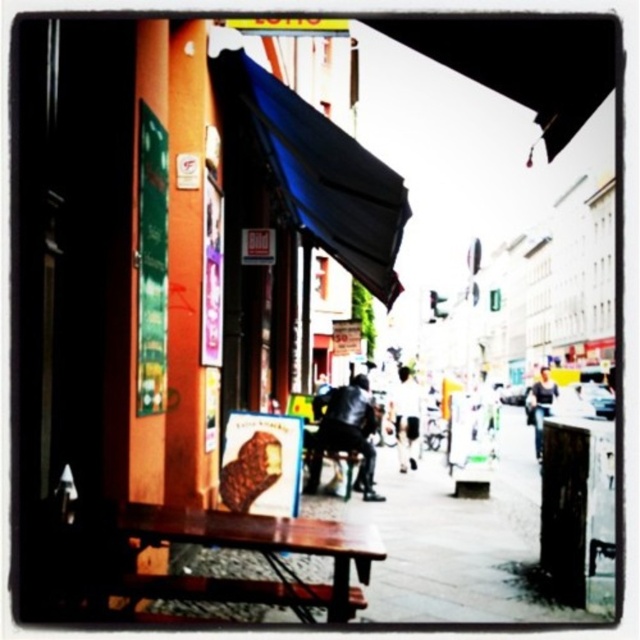
Can you confirm if wooden bench at center is wider than light blue denim jacket at center?

Incorrect, wooden bench at center's width does not surpass light blue denim jacket at center's.

Which is below, wooden bench at center or light blue denim jacket at center?

light blue denim jacket at center

I want to click on wooden bench at center, so click(337, 451).

Does wooden bench at center appear under white fabric bag at center?

Incorrect, wooden bench at center is not positioned below white fabric bag at center.

Is wooden bench at center to the right of white fabric bag at center from the viewer's perspective?

No, wooden bench at center is not to the right of white fabric bag at center.

Locate an element on the screen. wooden bench at center is located at coordinates (337, 451).

Can you confirm if blue fabric umbrella at upper center is positioned to the right of white fabric bag at center?

In fact, blue fabric umbrella at upper center is to the left of white fabric bag at center.

This screenshot has width=640, height=640. I want to click on blue fabric umbrella at upper center, so click(323, 173).

At what (x,y) coordinates should I click in order to perform the action: click on blue fabric umbrella at upper center. Please return your answer as a coordinate pair (x, y). This screenshot has height=640, width=640. Looking at the image, I should click on (323, 173).